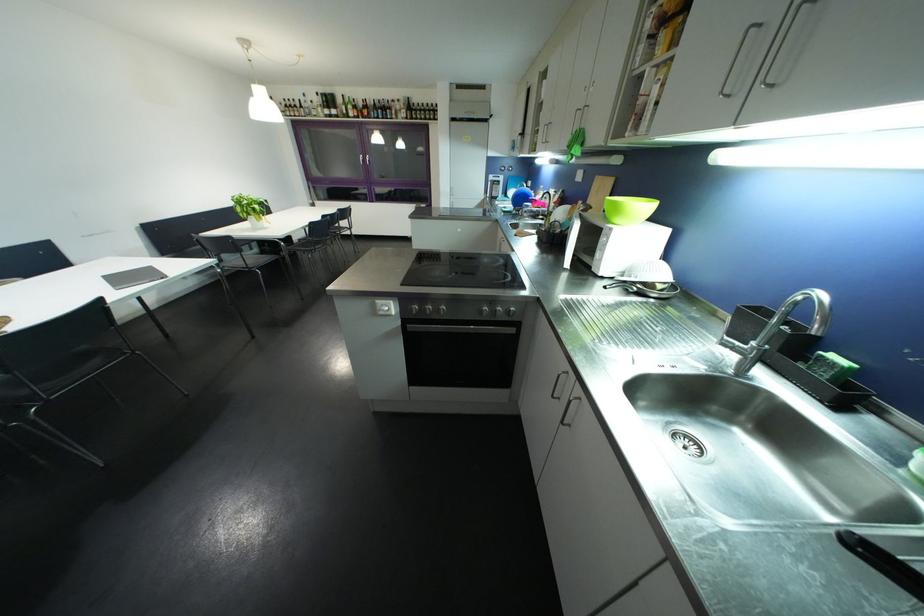
Find where to turn the silver oven dial. Please return your answer as a coordinate pair (x, y).

(415, 308)